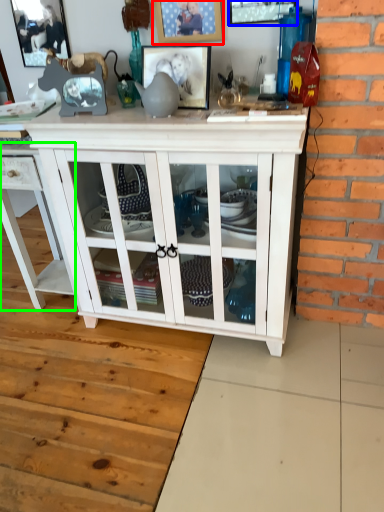
Question: Based on their relative distances, which object is farther from picture frame (highlighted by a red box)? Choose from picture frame (highlighted by a blue box) and cabinetry (highlighted by a green box).

Choices:
 (A) picture frame
 (B) cabinetry

Answer: (B)